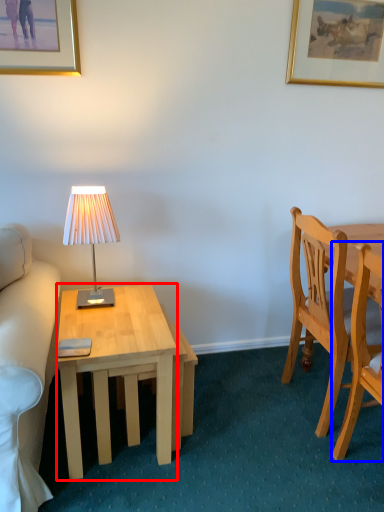
Question: Which object appears closest to the camera in this image, desk (highlighted by a red box) or chair (highlighted by a blue box)?

Choices:
 (A) desk
 (B) chair

Answer: (B)